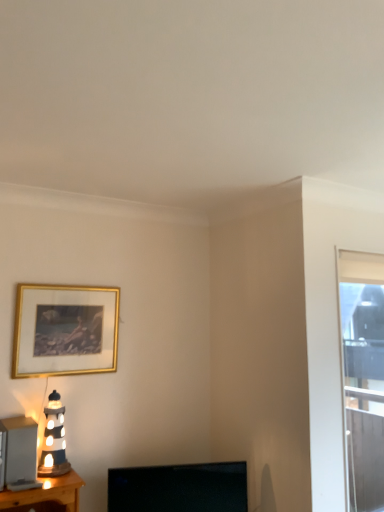
Question: Does point (9, 417) appear closer or farther from the camera than point (365, 381)?

Choices:
 (A) closer
 (B) farther

Answer: (A)

Question: From a real-world perspective, is matte black lamp at left above or below transparent glass window at right?

Choices:
 (A) above
 (B) below

Answer: (B)

Question: Which of these objects is positioned farthest from the gold metallic picture frame at upper left?

Choices:
 (A) black glossy tv at lower center
 (B) matte black lamp at left
 (C) transparent glass window at right
 (D) matte ceramic lighthouse at left

Answer: (C)

Question: Which object is the farthest from the black glossy tv at lower center?

Choices:
 (A) transparent glass window at right
 (B) gold metallic picture frame at upper left
 (C) matte black lamp at left
 (D) matte ceramic lighthouse at left

Answer: (A)